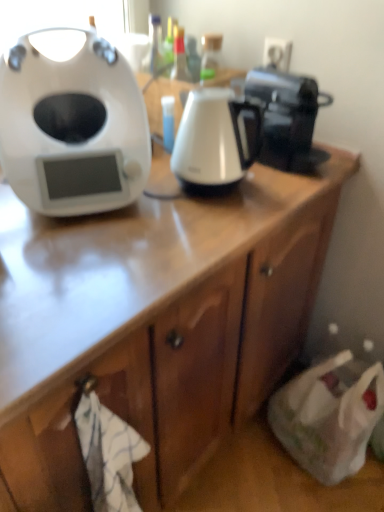
Question: Considering the positions of white glossy electric kettle at center and white matte/soft plastic at left in the image, is white glossy electric kettle at center taller or shorter than white matte/soft plastic at left?

Choices:
 (A) short
 (B) tall

Answer: (A)

Question: Visually, is white glossy electric kettle at center positioned to the left or to the right of white matte/soft plastic at left?

Choices:
 (A) left
 (B) right

Answer: (B)

Question: Considering the real-world distances, which object is closest to the black glossy coffee maker at upper right?

Choices:
 (A) white glossy electric kettle at center
 (B) white matte/soft plastic at left

Answer: (A)

Question: Based on their relative distances, which object is farther from the white glossy electric kettle at center?

Choices:
 (A) black glossy coffee maker at upper right
 (B) white matte/soft plastic at left

Answer: (B)